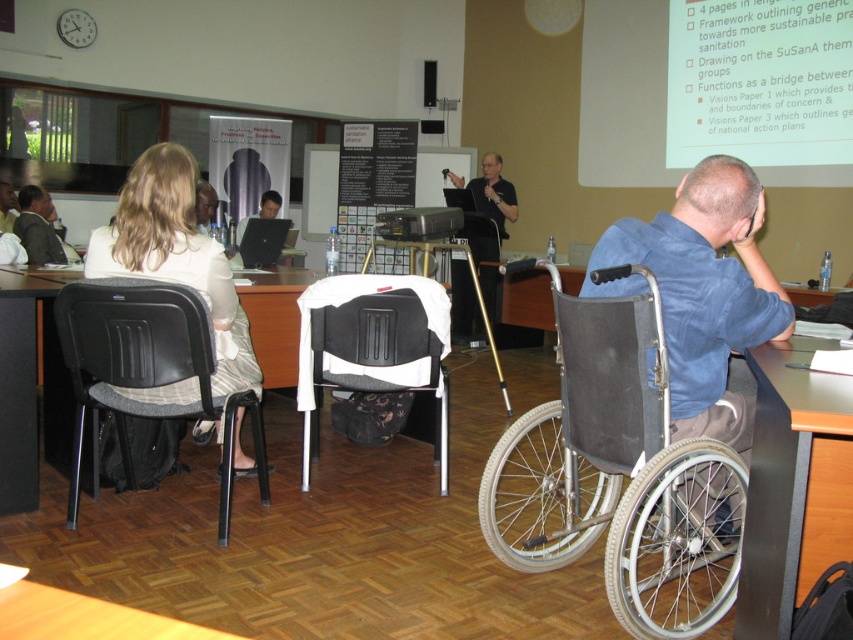
Question: Can you confirm if black wood table at lower right is positioned above matte black chair at left?

Choices:
 (A) no
 (B) yes

Answer: (A)

Question: From the image, what is the correct spatial relationship of white matte projection screen at upper right in relation to black fabric shirt at center?

Choices:
 (A) above
 (B) below

Answer: (A)

Question: Is blue denim shirt at center positioned behind dark suit jacket at left?

Choices:
 (A) no
 (B) yes

Answer: (A)

Question: Which point is closer to the camera?

Choices:
 (A) silver metallic wheelchair at right
 (B) matte black chair at left
 (C) black plastic chair at left
 (D) white matte projection screen at upper right

Answer: (A)

Question: Which object is farther from the camera taking this photo?

Choices:
 (A) white matte projection screen at upper right
 (B) black fabric shirt at center
 (C) blue denim shirt at center

Answer: (B)

Question: Among these points, which one is nearest to the camera?

Choices:
 (A) (759, 106)
 (B) (44, 298)

Answer: (B)